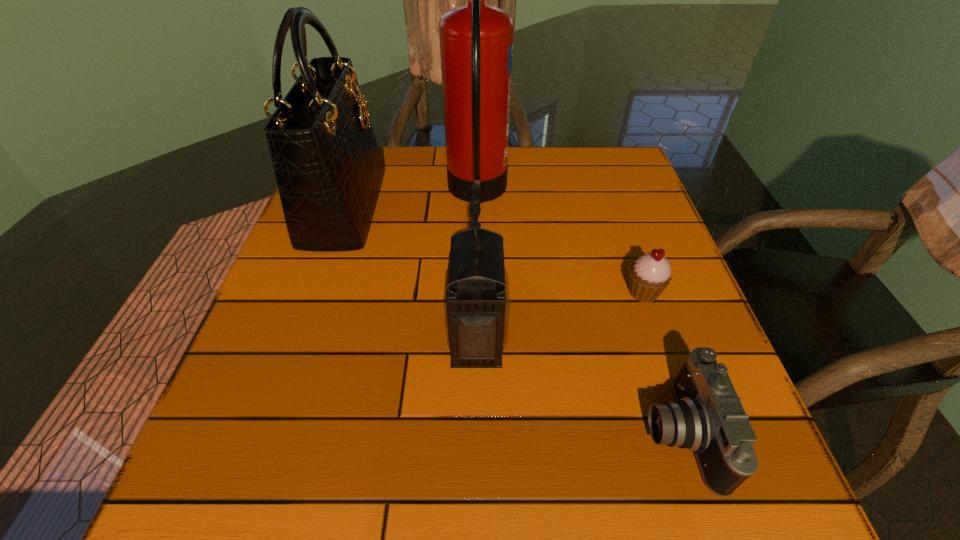
Identify the location of free space located 0.260m on the front-facing side of the nearest object. (473, 434).

What are the coordinates of `blank space located 0.400m on the front-facing side of the nearest object` in the screenshot? It's located at (380, 434).

Where is `vacant point located 0.220m on the front-facing side of the nearest object`? vacant point located 0.220m on the front-facing side of the nearest object is located at coordinates (499, 434).

The height and width of the screenshot is (540, 960). I want to click on free space located on the front of the third farthest object, so tap(669, 366).

This screenshot has height=540, width=960. I want to click on fire extinguisher located at the far edge, so click(476, 40).

What are the coordinates of `handbag positioned at the far edge` in the screenshot? It's located at (328, 167).

This screenshot has height=540, width=960. I want to click on object that is at the near edge, so click(707, 417).

Where is `object located in the left edge section of the desktop`? object located in the left edge section of the desktop is located at coordinates (328, 167).

The height and width of the screenshot is (540, 960). Find the location of `camera located in the right edge section of the desktop`. camera located in the right edge section of the desktop is located at coordinates (707, 417).

Locate an element on the screen. The width and height of the screenshot is (960, 540). cupcake that is at the right edge is located at coordinates (650, 274).